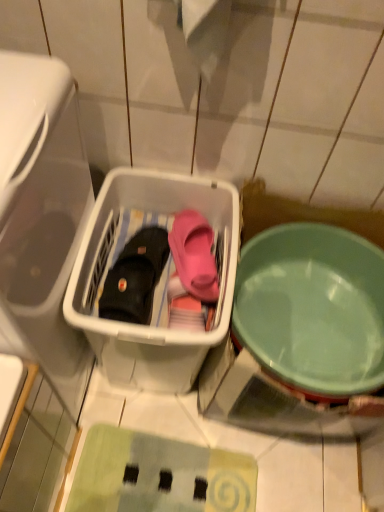
Question: Is transparent plastic basket at left not near black leather boot at center?

Choices:
 (A) yes
 (B) no

Answer: (B)

Question: Can you confirm if transparent plastic basket at left is bigger than black leather boot at center?

Choices:
 (A) no
 (B) yes

Answer: (B)

Question: Is black leather boot at center surrounded by transparent plastic basket at left?

Choices:
 (A) no
 (B) yes

Answer: (A)

Question: Does transparent plastic basket at left appear on the left side of black leather boot at center?

Choices:
 (A) no
 (B) yes

Answer: (B)

Question: Is the position of transparent plastic basket at left more distant than that of black leather boot at center?

Choices:
 (A) yes
 (B) no

Answer: (B)

Question: From the image's perspective, is transparent plastic basket at left above black leather boot at center?

Choices:
 (A) yes
 (B) no

Answer: (B)

Question: Is black leather boot at center to the right of light green plastic bowl at right from the viewer's perspective?

Choices:
 (A) yes
 (B) no

Answer: (B)

Question: Considering the relative sizes of black leather boot at center and light green plastic bowl at right in the image provided, is black leather boot at center wider than light green plastic bowl at right?

Choices:
 (A) yes
 (B) no

Answer: (B)

Question: Could you tell me if black leather boot at center is turned towards light green plastic bowl at right?

Choices:
 (A) yes
 (B) no

Answer: (B)

Question: Does black leather boot at center have a lesser width compared to light green plastic bowl at right?

Choices:
 (A) no
 (B) yes

Answer: (B)

Question: From the image's perspective, is black leather boot at center beneath light green plastic bowl at right?

Choices:
 (A) yes
 (B) no

Answer: (B)

Question: Is black leather boot at center looking in the opposite direction of light green plastic bowl at right?

Choices:
 (A) no
 (B) yes

Answer: (A)

Question: Does transparent plastic basket at left have a lesser width compared to light green plastic bowl at right?

Choices:
 (A) no
 (B) yes

Answer: (B)